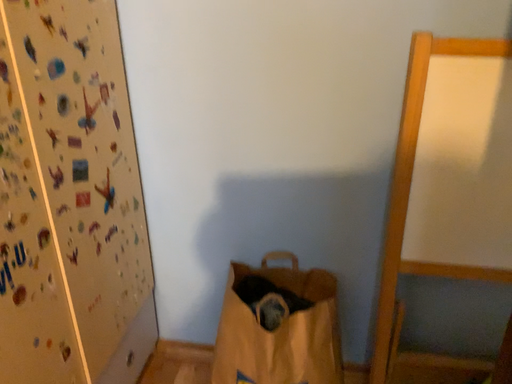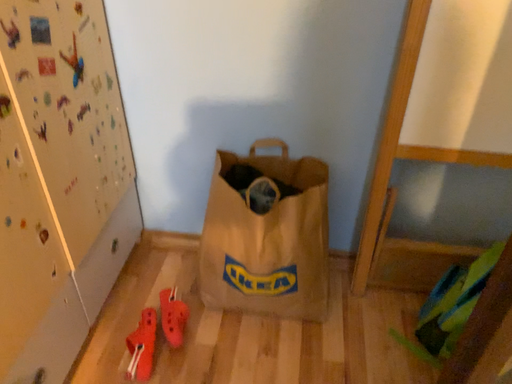
Question: How did the camera likely rotate when shooting the video?

Choices:
 (A) rotated upward
 (B) rotated downward

Answer: (B)